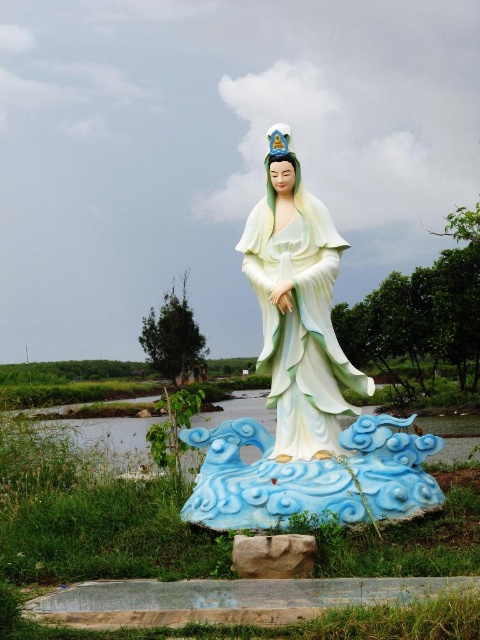
You are an art conservator inspecting the statue. You notice that the white glossy statue at center and the matte porcelain statue at center are both part of the same sculpture. Which one is placed higher up?

The matte porcelain statue at center is placed higher up since the white glossy statue at center is positioned under it.

You are an art curator planning to display both the white glossy statue at center and the matte porcelain statue at center in a gallery. Which statue should be placed on a higher pedestal to ensure they appear balanced in height?

The white glossy statue at center is taller than the matte porcelain statue at center, so placing the matte porcelain statue at center on a higher pedestal would help balance their overall heights.

From the picture: You are an art conservator assessing the statue located at point (303, 387). What is the primary color of the statue?

The primary color of the white glossy statue at center is white.